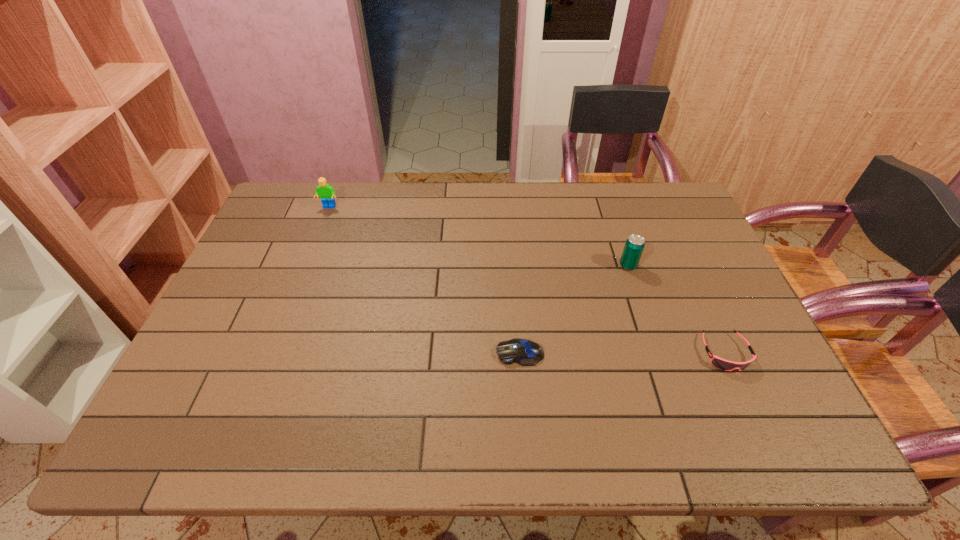
You are a GUI agent. You are given a task and a screenshot of the screen. Output one action in this format:
    pyautogui.click(x=<x>, y=<y>)
    Task: Click on the empty space between the second shortest object and the third nearest object
    The height and width of the screenshot is (540, 960).
    Given the screenshot: What is the action you would take?
    pyautogui.click(x=677, y=309)

The image size is (960, 540). I want to click on vacant space that is in between the shortest object and the beer can, so click(574, 309).

This screenshot has height=540, width=960. What are the coordinates of `free space between the farthest object and the second object from right to left` in the screenshot? It's located at (479, 237).

This screenshot has height=540, width=960. In order to click on object that ranks as the second closest to the second object from right to left in this screenshot , I will do `click(525, 352)`.

Choose which object is the third nearest neighbor to the computer mouse. Please provide its 2D coordinates. Your answer should be formatted as a tuple, i.e. [(x, y)], where the tuple contains the x and y coordinates of a point satisfying the conditions above.

[(325, 191)]

The height and width of the screenshot is (540, 960). Find the location of `vacant space that satisfies the following two spatial constraints: 1. on the face of the third nearest object; 2. on the left side of the Lego`. vacant space that satisfies the following two spatial constraints: 1. on the face of the third nearest object; 2. on the left side of the Lego is located at coordinates (306, 266).

Identify the location of vacant space that satisfies the following two spatial constraints: 1. on the face of the third nearest object; 2. on the left side of the farthest object. (306, 266).

Image resolution: width=960 pixels, height=540 pixels. Find the location of `vacant area that satisfies the following two spatial constraints: 1. on the face of the Lego; 2. on the left side of the third object from left to right`. vacant area that satisfies the following two spatial constraints: 1. on the face of the Lego; 2. on the left side of the third object from left to right is located at coordinates (306, 266).

You are a GUI agent. You are given a task and a screenshot of the screen. Output one action in this format:
    pyautogui.click(x=<x>, y=<y>)
    Task: Click on the vacant region that satisfies the following two spatial constraints: 1. on the face of the Lego; 2. on the left side of the third nearest object
    Image resolution: width=960 pixels, height=540 pixels.
    Given the screenshot: What is the action you would take?
    pyautogui.click(x=306, y=266)

Locate an element on the screen. The height and width of the screenshot is (540, 960). free space that satisfies the following two spatial constraints: 1. on the face of the second farthest object; 2. on the left side of the farthest object is located at coordinates (306, 266).